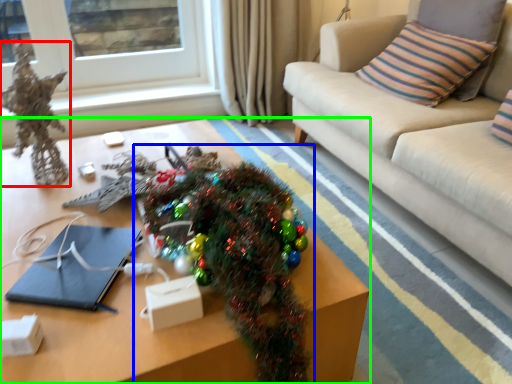
Question: Which object is positioned farthest from decor (highlighted by a red box)? Select from christmas tree (highlighted by a blue box) and table (highlighted by a green box).

Choices:
 (A) christmas tree
 (B) table

Answer: (A)